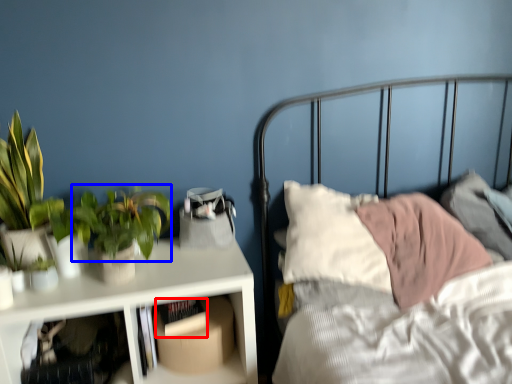
Question: Which of the following is the closest to the observer, book (highlighted by a red box) or vegetation (highlighted by a blue box)?

Choices:
 (A) book
 (B) vegetation

Answer: (B)